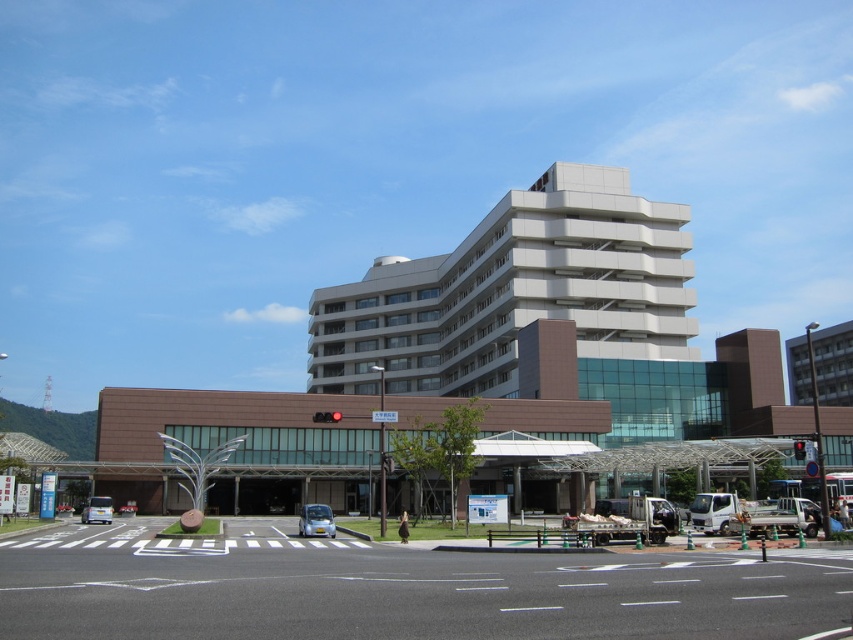
Who is more distant from viewer, (761, 616) or (97, 516)?

The point (97, 516) is more distant.

Can you confirm if white asphalt road at lower center is thinner than silver metallic car at lower left?

No.

Does point (566, 577) lie behind point (102, 497)?

No.

Find the location of a particular element. white asphalt road at lower center is located at coordinates (401, 589).

Who is more forward, (508,355) or (91,497)?

Point (91,497) is more forward.

Can you confirm if white smooth building at center is taller than silver metallic car at lower left?

Correct, white smooth building at center is much taller as silver metallic car at lower left.

Image resolution: width=853 pixels, height=640 pixels. What do you see at coordinates (514, 292) in the screenshot? I see `white smooth building at center` at bounding box center [514, 292].

Where is `white smooth building at center`? white smooth building at center is located at coordinates (514, 292).

In the scene shown: Can you confirm if silver metallic car at lower left is positioned to the right of red glass traffic light at center?

In fact, silver metallic car at lower left is to the left of red glass traffic light at center.

How distant is silver metallic car at lower left from red glass traffic light at center?

A distance of 57.34 feet exists between silver metallic car at lower left and red glass traffic light at center.

Where is `silver metallic car at lower left`? silver metallic car at lower left is located at coordinates (97, 509).

In order to click on silver metallic car at lower left in this screenshot , I will do `click(97, 509)`.